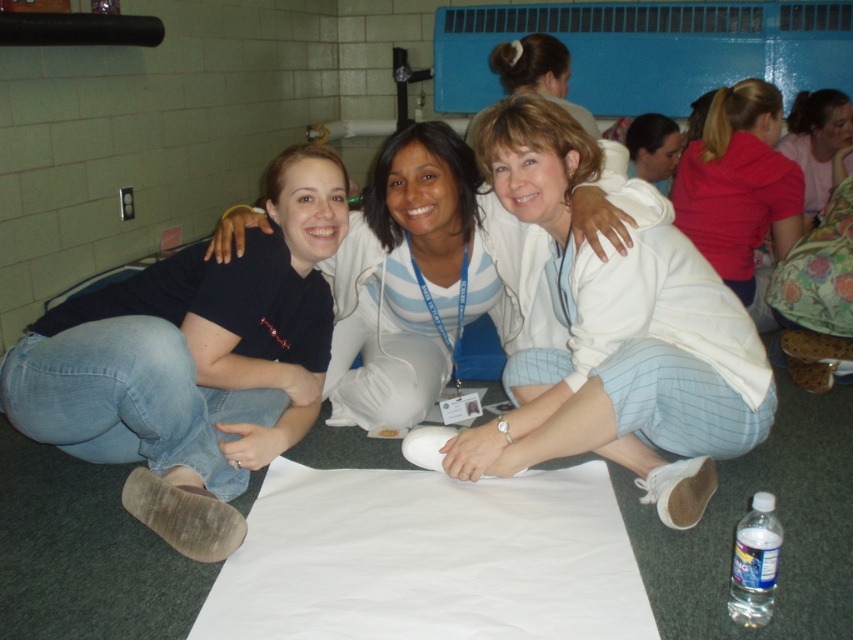
Can you confirm if white cotton shirt at center is smaller than pink fabric at upper right?

Actually, white cotton shirt at center might be larger than pink fabric at upper right.

Is white cotton shirt at center shorter than pink fabric at upper right?

No, white cotton shirt at center is not shorter than pink fabric at upper right.

This screenshot has width=853, height=640. Find the location of `white cotton shirt at center`. white cotton shirt at center is located at coordinates (405, 280).

Between matte pink shirt at upper right and pink fabric at upper right, which one has less height?

pink fabric at upper right is shorter.

Is matte pink shirt at upper right below pink fabric at upper right?

Indeed, matte pink shirt at upper right is positioned under pink fabric at upper right.

This screenshot has width=853, height=640. I want to click on matte pink shirt at upper right, so click(740, 189).

Does white soft sweater at center have a lesser width compared to pink fabric at upper right?

No.

Is white soft sweater at center wider than pink fabric at upper right?

Yes.

I want to click on white soft sweater at center, so click(612, 332).